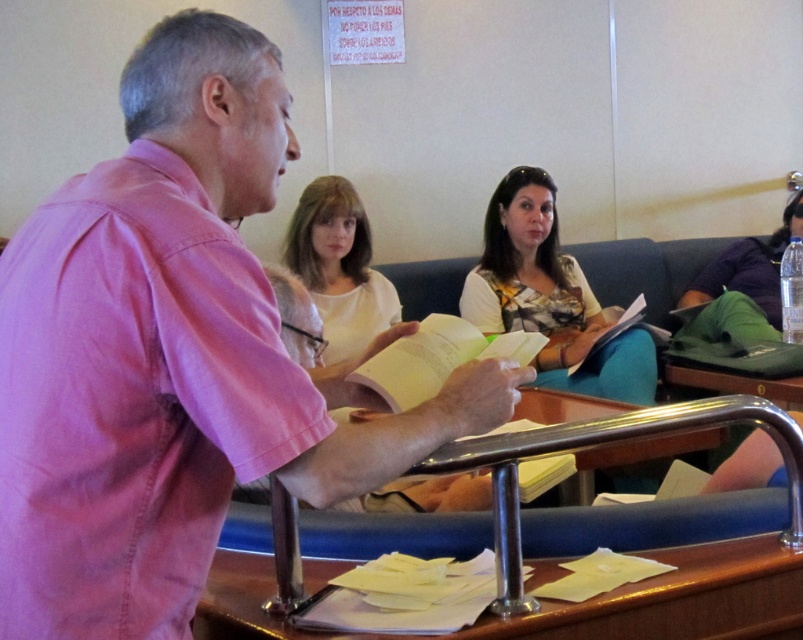
Question: Which point is farther to the camera?

Choices:
 (A) printed fabric blouse at center
 (B) wooden table at center

Answer: (A)

Question: From the image, what is the correct spatial relationship of printed fabric blouse at center in relation to white matte shirt at center?

Choices:
 (A) below
 (B) above

Answer: (A)

Question: Which point appears farthest from the camera in this image?

Choices:
 (A) (349, 356)
 (B) (704, 316)

Answer: (B)

Question: Can you confirm if printed fabric blouse at center is thinner than white matte shirt at center?

Choices:
 (A) no
 (B) yes

Answer: (A)

Question: Can you confirm if wooden table at center is positioned to the right of printed fabric blouse at center?

Choices:
 (A) no
 (B) yes

Answer: (A)

Question: Which of the following is the farthest from the observer?

Choices:
 (A) (569, 531)
 (B) (598, 380)
 (C) (767, 294)
 (D) (343, 321)

Answer: (C)